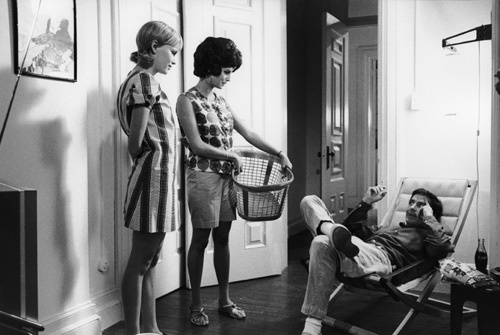
The image size is (500, 335). Find the location of `door`. door is located at coordinates (347, 75).